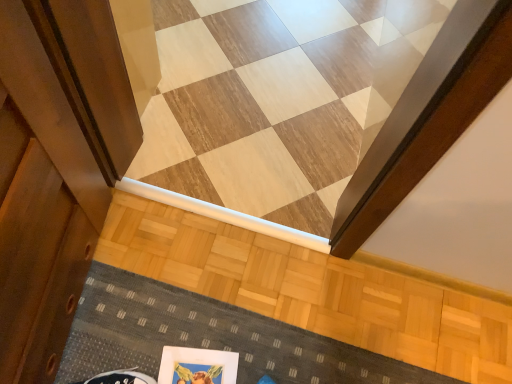
Question: In the image, is textured gray doormat at lower center positioned in front of or behind wooden floor at center?

Choices:
 (A) front
 (B) behind

Answer: (A)

Question: From a real-world perspective, is textured gray doormat at lower center above or below wooden floor at center?

Choices:
 (A) above
 (B) below

Answer: (B)

Question: Estimate the real-world distances between objects in this image. Which object is closer to the wooden floor at center?

Choices:
 (A) textured gray doormat at lower center
 (B) matte white picture frame at lower center

Answer: (A)

Question: Which object is the farthest from the matte white picture frame at lower center?

Choices:
 (A) wooden floor at center
 (B) textured gray doormat at lower center

Answer: (A)